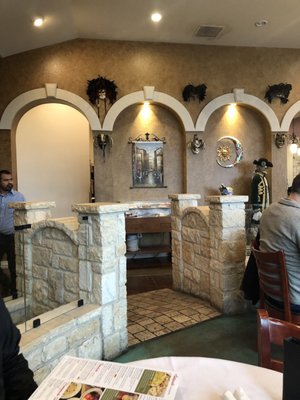
Locate an element on the screen. This screenshot has width=300, height=400. silver pieces on wall is located at coordinates (102, 95), (194, 146), (281, 142), (99, 143), (239, 148), (280, 95), (195, 99).